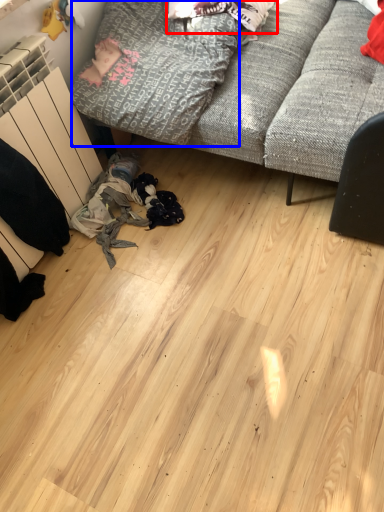
Question: Which point is further to the camera, clothing (highlighted by a red box) or clothing (highlighted by a blue box)?

Choices:
 (A) clothing
 (B) clothing

Answer: (A)